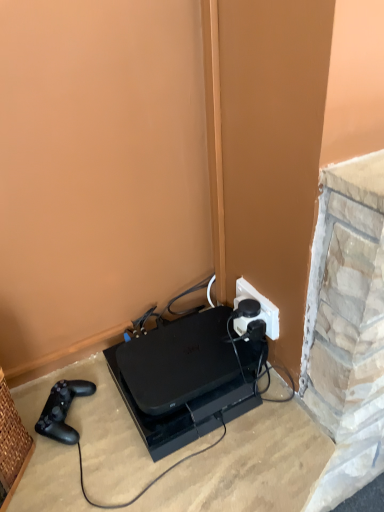
Find the location of a particular element. This screenshot has height=512, width=384. free spot in front of black plastic gaming console at lower center is located at coordinates (193, 474).